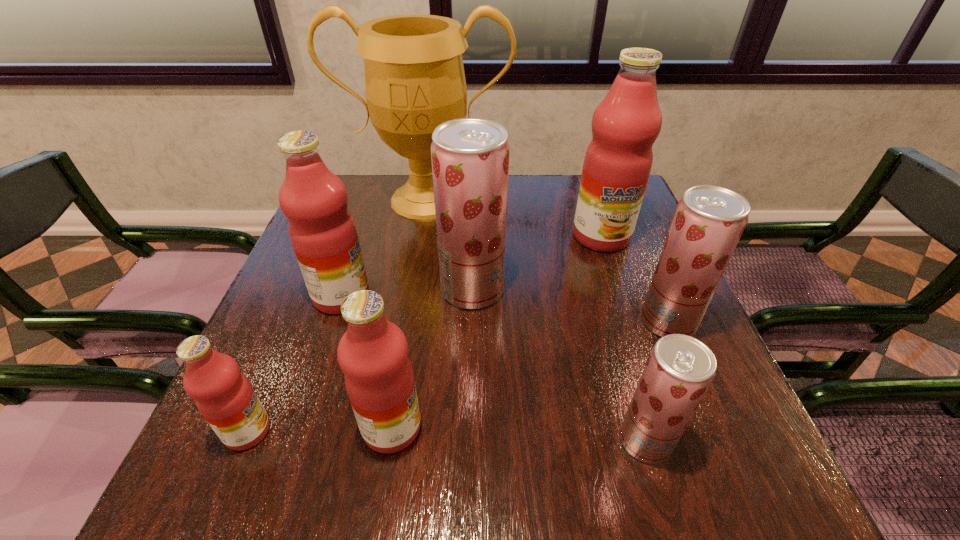
Identify the location of vacant space that satisfies the following two spatial constraints: 1. on the label of the rightmost pink fruit juice; 2. on the label of the smallest pink fruit juice. The image size is (960, 540). point(667,431).

Identify the location of free space that satisfies the following two spatial constraints: 1. on the engravings side of the trophy; 2. on the label of the second farthest pink fruit juice. The width and height of the screenshot is (960, 540). click(410, 296).

Where is `vacant position in the image that satisfies the following two spatial constraints: 1. on the label of the second farthest pink fruit juice; 2. on the left side of the second strawberry fruit juice from left to right`? The height and width of the screenshot is (540, 960). vacant position in the image that satisfies the following two spatial constraints: 1. on the label of the second farthest pink fruit juice; 2. on the left side of the second strawberry fruit juice from left to right is located at coordinates click(294, 441).

Locate an element on the screen. The width and height of the screenshot is (960, 540). vacant space that satisfies the following two spatial constraints: 1. on the engravings side of the trophy; 2. on the left side of the rightmost strawberry fruit juice is located at coordinates (406, 322).